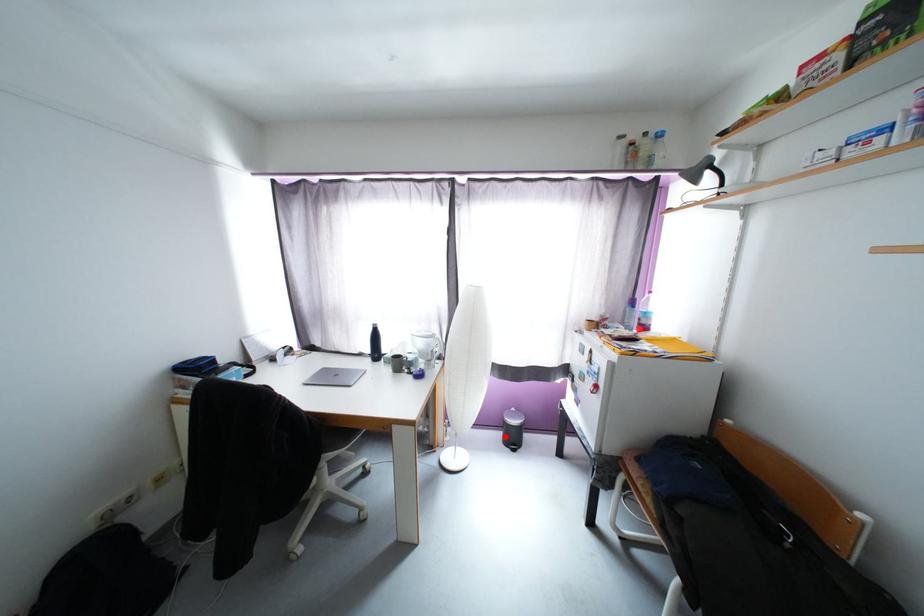
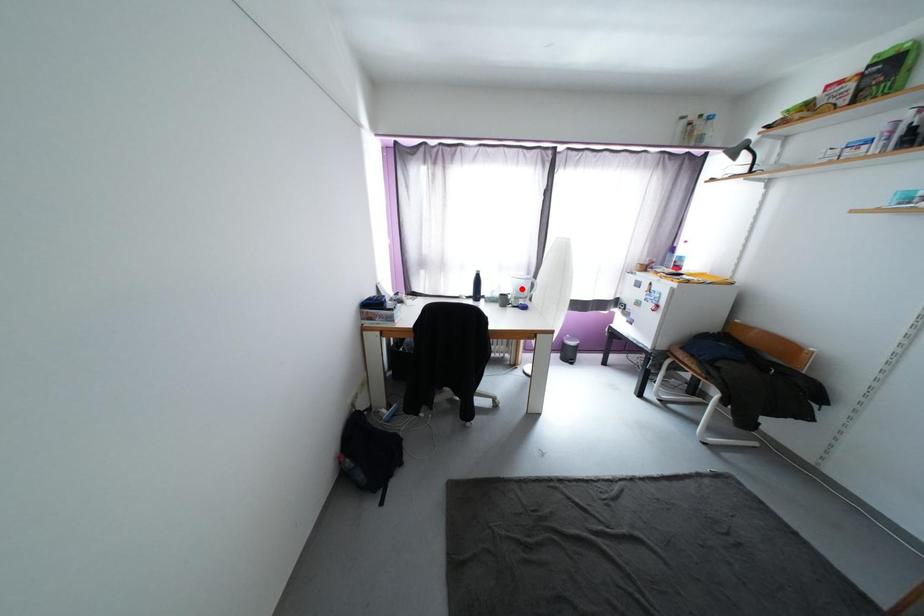
I am providing you with two images of the same scene from different viewpoints. A red point is marked on the first image and another point is marked on the second image. Is the red point in image1 aligned with the point shown in image2?

No